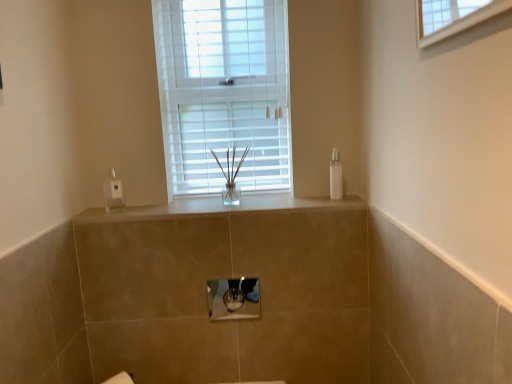
The height and width of the screenshot is (384, 512). What do you see at coordinates (113, 192) in the screenshot?
I see `clear plastic soap dispenser at left` at bounding box center [113, 192].

Measure the distance between point (339, 192) and camera.

Point (339, 192) is 5.50 feet from camera.

Measure the distance between point (86, 213) and camera.

Point (86, 213) is 1.62 meters from camera.

Image resolution: width=512 pixels, height=384 pixels. What do you see at coordinates (217, 208) in the screenshot?
I see `satin beige countertop at center` at bounding box center [217, 208].

This screenshot has width=512, height=384. What are the coordinates of `clear plastic soap dispenser at left` in the screenshot? It's located at (113, 192).

Find the location of a particular element. soap dispenser in front of the white plastic window at center is located at coordinates (113, 192).

From the picture: Does clear plastic soap dispenser at left turn towards white plastic window at center?

No, clear plastic soap dispenser at left is not aimed at white plastic window at center.

Measure the distance between clear plastic soap dispenser at left and white plastic window at center.

23.24 inches.

In the scene shown: Is white plastic window at center located within clear plastic soap dispenser at left?

Definitely not — white plastic window at center is not inside clear plastic soap dispenser at left.

Which is more to the left, metallic silver medicine cabinet at center or clear plastic bottle at right?

From the viewer's perspective, metallic silver medicine cabinet at center appears more on the left side.

Does metallic silver medicine cabinet at center have a lesser width compared to clear plastic bottle at right?

Indeed, metallic silver medicine cabinet at center has a lesser width compared to clear plastic bottle at right.

At what (x,y) coordinates should I click in order to perform the action: click on toiletry on the right of metallic silver medicine cabinet at center. Please return your answer as a coordinate pair (x, y). Looking at the image, I should click on point(336,176).

Is metallic silver medicine cabinet at center positioned in front of clear plastic bottle at right?

Yes, metallic silver medicine cabinet at center is in front of clear plastic bottle at right.

From their relative heights in the image, would you say satin beige countertop at center is taller or shorter than white plastic window at center?

satin beige countertop at center is shorter than white plastic window at center.

Considering the sizes of satin beige countertop at center and white plastic window at center in the image, is satin beige countertop at center wider or thinner than white plastic window at center?

Considering their sizes, satin beige countertop at center looks broader than white plastic window at center.

From the image's perspective, does satin beige countertop at center appear higher than white plastic window at center?

No, from the image's perspective, satin beige countertop at center is not on top of white plastic window at center.

Is white plastic window at center wider than clear plastic soap dispenser at left?

Correct, the width of white plastic window at center exceeds that of clear plastic soap dispenser at left.

Are white plastic window at center and clear plastic soap dispenser at left far apart?

No.

Considering the sizes of white plastic window at center and clear plastic soap dispenser at left in the image, is white plastic window at center taller or shorter than clear plastic soap dispenser at left?

Considering their sizes, white plastic window at center has more height than clear plastic soap dispenser at left.

Is point (226, 20) closer or farther from the camera than point (116, 182)?

Clearly, point (226, 20) is more distant from the camera than point (116, 182).

Is white plastic window at center facing away from metallic silver medicine cabinet at center?

white plastic window at center does not have its back to metallic silver medicine cabinet at center.

Considering the sizes of objects white plastic window at center and metallic silver medicine cabinet at center in the image provided, who is thinner, white plastic window at center or metallic silver medicine cabinet at center?

With smaller width is metallic silver medicine cabinet at center.

From a real-world perspective, is white plastic window at center physically above metallic silver medicine cabinet at center?

Yes, from a real-world perspective, white plastic window at center is above metallic silver medicine cabinet at center.

Is metallic silver medicine cabinet at center next to clear plastic soap dispenser at left and touching it?

No, metallic silver medicine cabinet at center is not in contact with clear plastic soap dispenser at left.

Locate an element on the screen. medicine cabinet lying below the clear plastic soap dispenser at left (from the image's perspective) is located at coordinates (234, 298).

Is metallic silver medicine cabinet at center oriented towards clear plastic soap dispenser at left?

No, metallic silver medicine cabinet at center does not turn towards clear plastic soap dispenser at left.

Which is behind, point (230, 314) or point (120, 206)?

The point (120, 206) is more distant.

Is clear plastic bottle at right bigger than satin beige countertop at center?

Actually, clear plastic bottle at right might be smaller than satin beige countertop at center.

Is clear plastic bottle at right inside the boundaries of satin beige countertop at center, or outside?

clear plastic bottle at right is located beyond the bounds of satin beige countertop at center.

At what (x,y) coordinates should I click in order to perform the action: click on soap dispenser on the left of white plastic window at center. Please return your answer as a coordinate pair (x, y). Looking at the image, I should click on (113, 192).

I want to click on toiletry behind the metallic silver medicine cabinet at center, so click(336, 176).

Based on their spatial positions, is satin beige countertop at center or metallic silver medicine cabinet at center further from clear plastic soap dispenser at left?

metallic silver medicine cabinet at center lies further to clear plastic soap dispenser at left than the other object.

In the scene shown: When comparing their distances from metallic silver medicine cabinet at center, does white plastic window at center or clear plastic bottle at right seem closer?

Among the two, clear plastic bottle at right is located nearer to metallic silver medicine cabinet at center.

Looking at this image, looking at the image, which one is located further to clear plastic soap dispenser at left, metallic silver medicine cabinet at center or satin beige countertop at center?

The object further to clear plastic soap dispenser at left is metallic silver medicine cabinet at center.

Considering their positions, is white plastic window at center positioned closer to satin beige countertop at center than clear plastic soap dispenser at left?

clear plastic soap dispenser at left lies closer to satin beige countertop at center than the other object.

Estimate the real-world distances between objects in this image. Which object is closer to clear plastic bottle at right, satin beige countertop at center or clear plastic soap dispenser at left?

satin beige countertop at center is closer to clear plastic bottle at right.

Which object lies nearer to the anchor point satin beige countertop at center, clear plastic bottle at right or clear plastic soap dispenser at left?

Among the two, clear plastic soap dispenser at left is located nearer to satin beige countertop at center.

Which object lies further to the anchor point satin beige countertop at center, clear plastic bottle at right or white plastic window at center?

white plastic window at center is further to satin beige countertop at center.

When comparing their distances from white plastic window at center, does metallic silver medicine cabinet at center or clear plastic bottle at right seem further?

metallic silver medicine cabinet at center.

At what (x,y) coordinates should I click in order to perform the action: click on counter top between white plastic window at center and metallic silver medicine cabinet at center in the vertical direction. Please return your answer as a coordinate pair (x, y). The width and height of the screenshot is (512, 384). Looking at the image, I should click on (217, 208).

Find the location of `toiletry that lies between white plastic window at center and metallic silver medicine cabinet at center from top to bottom`. toiletry that lies between white plastic window at center and metallic silver medicine cabinet at center from top to bottom is located at coordinates (336, 176).

Locate an element on the screen. The image size is (512, 384). counter top between clear plastic soap dispenser at left and clear plastic bottle at right is located at coordinates (217, 208).

Find the location of a particular element. soap dispenser between white plastic window at center and metallic silver medicine cabinet at center vertically is located at coordinates (113, 192).